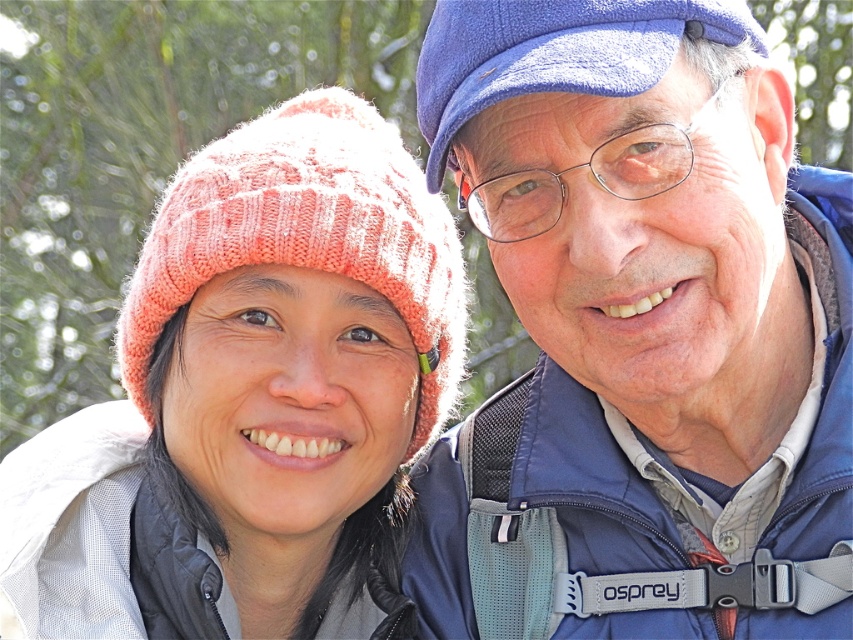
Who is shorter, blue fabric jacket at upper right or blue fabric cap at upper right?

blue fabric cap at upper right is shorter.

In order to click on blue fabric jacket at upper right in this screenshot , I will do `click(640, 332)`.

Identify the location of blue fabric jacket at upper right. This screenshot has width=853, height=640. (640, 332).

You are a GUI agent. You are given a task and a screenshot of the screen. Output one action in this format:
    pyautogui.click(x=<x>, y=<y>)
    Task: Click on the pink knitted beanie at upper left
    This screenshot has height=640, width=853.
    Given the screenshot: What is the action you would take?
    pyautogui.click(x=252, y=401)

Who is shorter, pink knitted beanie at upper left or blue fabric cap at upper right?

With less height is blue fabric cap at upper right.

Who is more forward, (231, 568) or (514, 22)?

Point (514, 22)

What are the coordinates of `pink knitted beanie at upper left` in the screenshot? It's located at (252, 401).

Between blue fabric jacket at upper right and pink knitted beanie at upper left, which one is positioned lower?

pink knitted beanie at upper left

Can you confirm if blue fabric jacket at upper right is positioned above pink knitted beanie at upper left?

Yes, blue fabric jacket at upper right is above pink knitted beanie at upper left.

This screenshot has height=640, width=853. Describe the element at coordinates (640, 332) in the screenshot. I see `blue fabric jacket at upper right` at that location.

You are a GUI agent. You are given a task and a screenshot of the screen. Output one action in this format:
    pyautogui.click(x=<x>, y=<y>)
    Task: Click on the blue fabric jacket at upper right
    
    Given the screenshot: What is the action you would take?
    pyautogui.click(x=640, y=332)